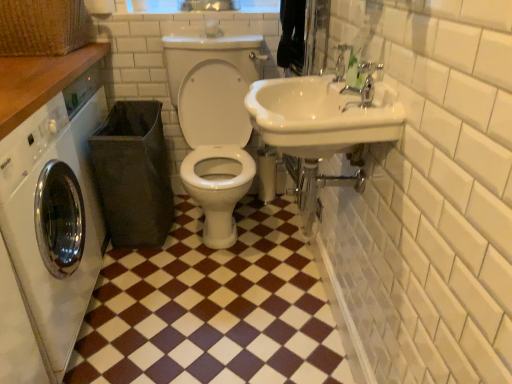
Where is `vacant region in front of silver metallic faucet at upper right`? The height and width of the screenshot is (384, 512). vacant region in front of silver metallic faucet at upper right is located at coordinates (x=366, y=114).